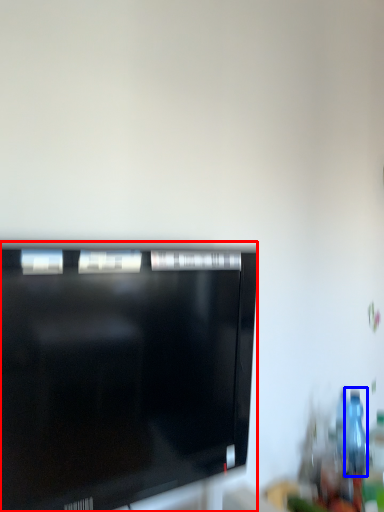
Question: Which of the following is the farthest to the observer, television (highlighted by a red box) or bottle (highlighted by a blue box)?

Choices:
 (A) television
 (B) bottle

Answer: (B)